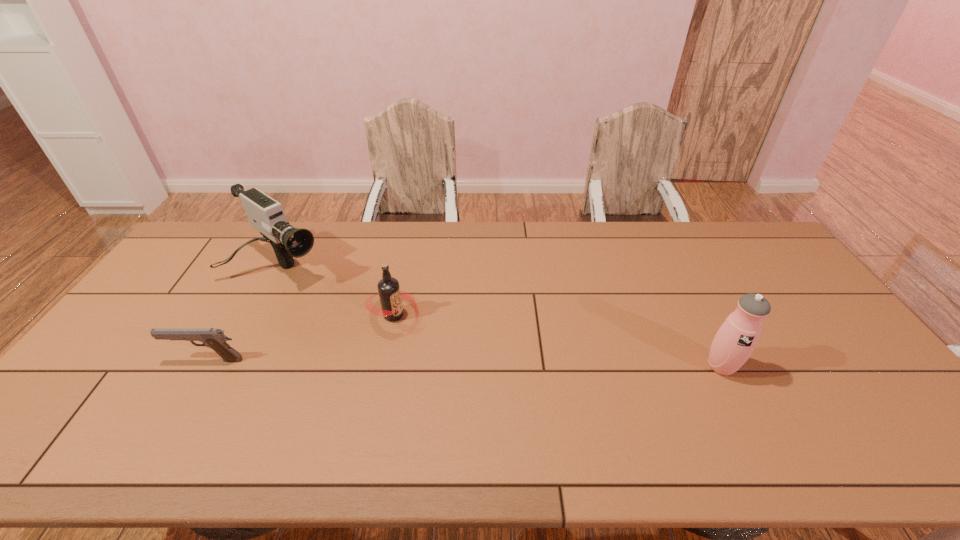
The height and width of the screenshot is (540, 960). What are the coordinates of `free spot at the near left corner of the desktop` in the screenshot? It's located at (71, 405).

Find the location of `unoccupied position between the third tallest object and the thermos bottle`. unoccupied position between the third tallest object and the thermos bottle is located at coordinates (558, 341).

What are the coordinates of `unoccupied area between the pistol and the rightmost object` in the screenshot? It's located at [464, 363].

Where is `free space that is in between the pistol and the rightmost object`? free space that is in between the pistol and the rightmost object is located at coordinates (464, 363).

This screenshot has height=540, width=960. I want to click on free space between the camcorder and the shortest object, so click(x=243, y=314).

Where is `free spot between the third object from left to right and the farthest object`? The width and height of the screenshot is (960, 540). free spot between the third object from left to right and the farthest object is located at coordinates (336, 292).

Find the location of a particular element. Image resolution: width=960 pixels, height=540 pixels. free spot between the thermos bottle and the root beer is located at coordinates [558, 341].

Where is `vacant space in between the pistol and the farthest object`? This screenshot has height=540, width=960. vacant space in between the pistol and the farthest object is located at coordinates (243, 314).

This screenshot has height=540, width=960. Identify the location of vacant area that lies between the third tallest object and the thermos bottle. (558, 341).

I want to click on vacant point located between the thermos bottle and the third nearest object, so click(x=558, y=341).